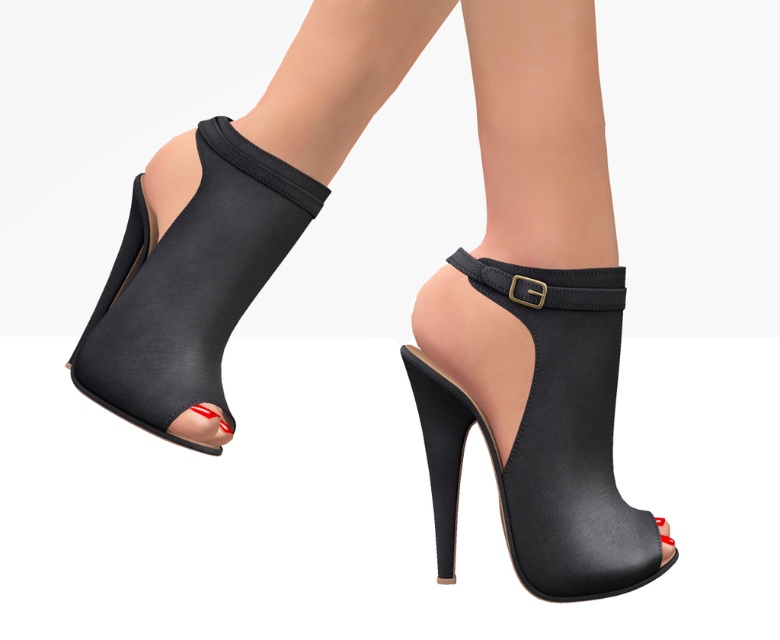
Question: Which point is farther to the camera?

Choices:
 (A) (507, 276)
 (B) (314, 26)
 (C) (270, 189)

Answer: (C)

Question: Is satin black sock at center wider than black leather strap at center?

Choices:
 (A) no
 (B) yes

Answer: (B)

Question: Does satin black high-heeled shoe at center have a greater width compared to satin black sock at center?

Choices:
 (A) yes
 (B) no

Answer: (A)

Question: Is satin black peep-toe sandal at center to the right of black leather strap at center from the viewer's perspective?

Choices:
 (A) yes
 (B) no

Answer: (B)

Question: Which object is farther from the camera taking this photo?

Choices:
 (A) black leather strap at center
 (B) satin black peep-toe sandal at center

Answer: (A)

Question: Which of the following is the closest to the observer?

Choices:
 (A) (619, 308)
 (B) (270, 252)
 (C) (546, 385)

Answer: (C)